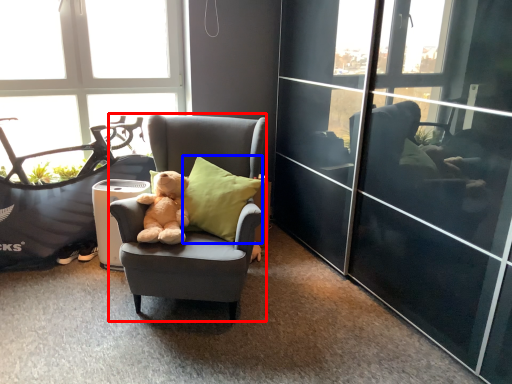
Question: Among these objects, which one is farthest to the camera, chair (highlighted by a red box) or pillow (highlighted by a blue box)?

Choices:
 (A) chair
 (B) pillow

Answer: (B)